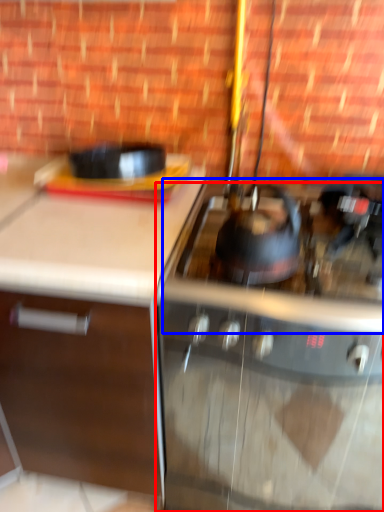
Question: Which object appears closest to the camera in this image, gas stove (highlighted by a red box) or gas stove (highlighted by a blue box)?

Choices:
 (A) gas stove
 (B) gas stove

Answer: (B)